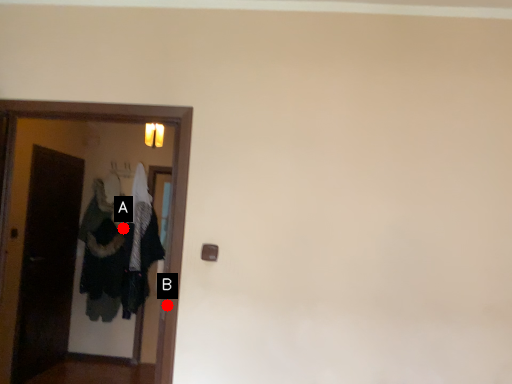
Question: Two points are circled on the image, labeled by A and B beside each circle. Which point is farther to the camera?

Choices:
 (A) A is further
 (B) B is further

Answer: (A)